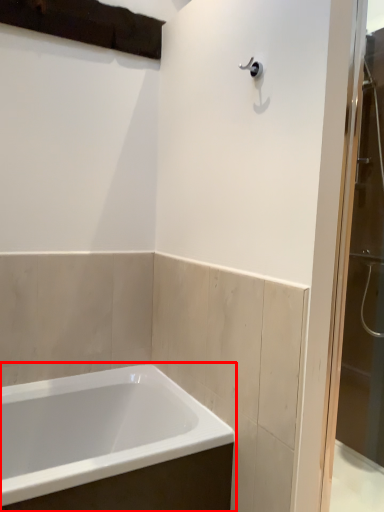
Question: From the image's perspective, where is bathtub (annotated by the red box) located relative to screen door?

Choices:
 (A) below
 (B) above

Answer: (A)